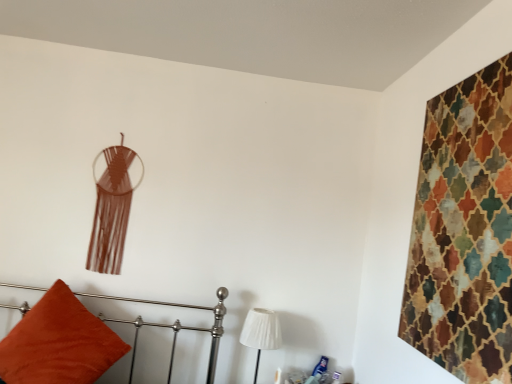
Question: Is velvet orange pillow at lower left shorter than white pleated fabric at lower center?

Choices:
 (A) no
 (B) yes

Answer: (A)

Question: From a real-world perspective, is velvet orange pillow at lower left positioned over white pleated fabric at lower center based on gravity?

Choices:
 (A) no
 (B) yes

Answer: (A)

Question: From a real-world perspective, is velvet orange pillow at lower left under white pleated fabric at lower center?

Choices:
 (A) yes
 (B) no

Answer: (A)

Question: Is velvet orange pillow at lower left positioned far away from white pleated fabric at lower center?

Choices:
 (A) no
 (B) yes

Answer: (A)

Question: Does velvet orange pillow at lower left have a smaller size compared to white pleated fabric at lower center?

Choices:
 (A) no
 (B) yes

Answer: (A)

Question: Does velvet orange pillow at lower left lie in front of white pleated fabric at lower center?

Choices:
 (A) yes
 (B) no

Answer: (A)

Question: Is white pleated fabric at lower center shorter than velvet orange pillow at lower left?

Choices:
 (A) yes
 (B) no

Answer: (A)

Question: Can you confirm if white pleated fabric at lower center is wider than velvet orange pillow at lower left?

Choices:
 (A) yes
 (B) no

Answer: (B)

Question: Can you confirm if white pleated fabric at lower center is thinner than velvet orange pillow at lower left?

Choices:
 (A) no
 (B) yes

Answer: (B)

Question: From the image's perspective, does white pleated fabric at lower center appear lower than velvet orange pillow at lower left?

Choices:
 (A) yes
 (B) no

Answer: (A)

Question: Is the position of white pleated fabric at lower center more distant than that of velvet orange pillow at lower left?

Choices:
 (A) yes
 (B) no

Answer: (A)

Question: From a real-world perspective, is white pleated fabric at lower center on top of velvet orange pillow at lower left?

Choices:
 (A) no
 (B) yes

Answer: (B)

Question: Is textured multicolored tapestry at upper right shorter than velvet orange pillow at lower left?

Choices:
 (A) yes
 (B) no

Answer: (B)